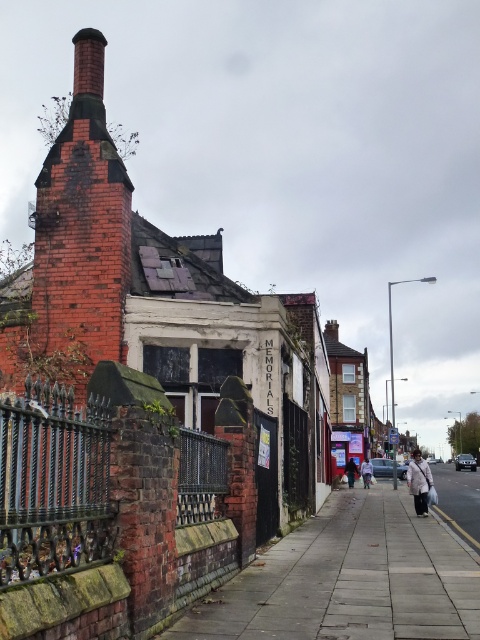
You are a delivery person trying to place both the light beige fabric coat at center and the dark brown leather jacket at center into a storage box that can hold items up to 1.2 meters in width. Can both items fit side by side?

The light beige fabric coat at center is wider than the dark brown leather jacket at center. Since the storage box can hold items up to 1.2 meters in width, both items can fit side by side as long as their combined width does not exceed 1.2 meters. However, without knowing the exact widths of each item, it is impossible to determine definitively.